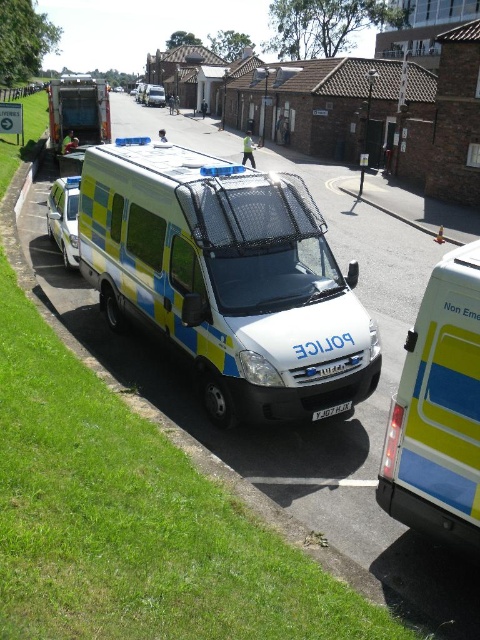
You are a pedestrian standing on the sidewalk and see the yellow and blue plastic van at right and the blue and yellow painted van at center. Which van is located to the right of the other?

The yellow and blue plastic van at right is positioned on the right side of blue and yellow painted van at center.

You are a traffic officer trying to locate the blue and yellow painted van at left in the scene. According to the coordinates provided, where exactly is it positioned?

The blue and yellow painted van at left is positioned at point (78, 109).